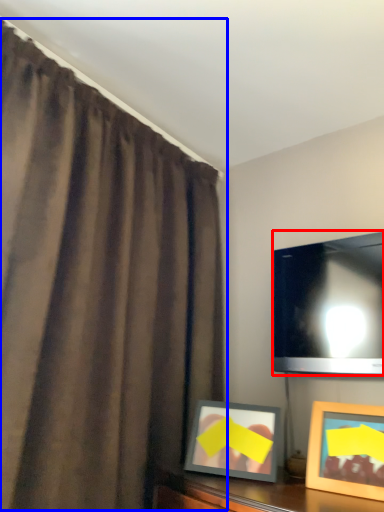
Question: Which object appears closest to the camera in this image, television (highlighted by a red box) or curtain (highlighted by a blue box)?

Choices:
 (A) television
 (B) curtain

Answer: (B)